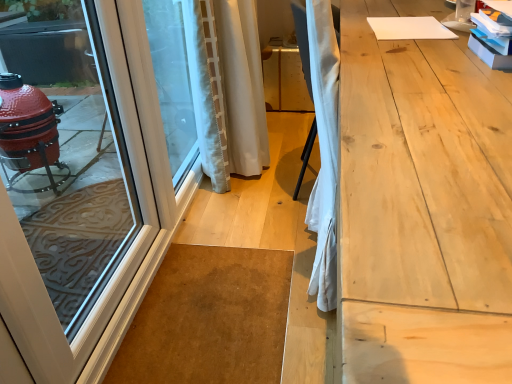
Looking at this image, what is the approximate height of transparent glass window screen at left?

transparent glass window screen at left is 88.68 centimeters in height.

I want to click on white textured curtain at center, so click(x=226, y=90).

Locate an element on the screen. This screenshot has width=512, height=384. light wood workbench at right is located at coordinates (423, 207).

Is the position of white textured curtain at center more distant than that of transparent glass window screen at left?

Yes, white textured curtain at center is behind transparent glass window screen at left.

Is white textured curtain at center directly adjacent to transparent glass window screen at left?

No, white textured curtain at center is not with transparent glass window screen at left.

Which is behind, point (248, 115) or point (178, 130)?

The point (178, 130) is farther from the camera.

Which of these two, white textured curtain at center or transparent glass window screen at left, stands taller?

Standing taller between the two is transparent glass window screen at left.

Is light wood workbench at right oriented towards white glossy door at left?

No, light wood workbench at right does not turn towards white glossy door at left.

Visually, is light wood workbench at right positioned to the left or to the right of white glossy door at left?

From the image, it's evident that light wood workbench at right is to the right of white glossy door at left.

Is light wood workbench at right next to white glossy door at left and touching it?

light wood workbench at right is not next to white glossy door at left, and they're not touching.

From the image's perspective, is light wood workbench at right below white glossy door at left?

No, from the image's perspective, light wood workbench at right is not below white glossy door at left.

Is white glossy door at left oriented towards transparent glass window screen at left?

No, white glossy door at left is not facing towards transparent glass window screen at left.

Looking at this image, between white glossy door at left and transparent glass window screen at left, which one has more height?

white glossy door at left.

What's the angular difference between white glossy door at left and transparent glass window screen at left's facing directions?

There is a 0.0015-degree angle between the facing directions of white glossy door at left and transparent glass window screen at left.

Considering the positions of objects white glossy door at left and white textured curtain at center in the image provided, who is in front, white glossy door at left or white textured curtain at center?

Positioned in front is white glossy door at left.

Considering the relative sizes of white glossy door at left and white textured curtain at center in the image provided, is white glossy door at left bigger than white textured curtain at center?

Incorrect, white glossy door at left is not larger than white textured curtain at center.

From the image's perspective, is white glossy door at left located above white textured curtain at center?

Incorrect, from the image's perspective, white glossy door at left is lower than white textured curtain at center.

Can you tell me how much white glossy door at left and white textured curtain at center differ in facing direction?

0.0892 degrees separate the facing orientations of white glossy door at left and white textured curtain at center.

Which of these two, transparent glass window screen at left or white glossy door at left, is bigger?

With larger size is white glossy door at left.

Is transparent glass window screen at left further to camera compared to white glossy door at left?

Yes, transparent glass window screen at left is behind white glossy door at left.

From the image's perspective, who appears lower, transparent glass window screen at left or white glossy door at left?

white glossy door at left is shown below in the image.

Based on the photo, can you confirm if transparent glass window screen at left is positioned to the right of white glossy door at left?

Yes.

From a real-world perspective, which is physically below, white glossy door at left or light wood workbench at right?

light wood workbench at right is physically lower.

Between white glossy door at left and light wood workbench at right, which one has less height?

With less height is light wood workbench at right.

Considering the relative sizes of white glossy door at left and light wood workbench at right in the image provided, is white glossy door at left bigger than light wood workbench at right?

No.

Is white glossy door at left positioned behind light wood workbench at right?

That is True.

Between transparent glass window screen at left and white textured curtain at center, which one is positioned behind?

white textured curtain at center is more distant.

Who is bigger, transparent glass window screen at left or white textured curtain at center?

white textured curtain at center.

Is transparent glass window screen at left inside the boundaries of white textured curtain at center, or outside?

transparent glass window screen at left is not enclosed by white textured curtain at center.

Where is `window screen lying on the left of white textured curtain at center`? window screen lying on the left of white textured curtain at center is located at coordinates (172, 84).

This screenshot has width=512, height=384. Identify the location of door below the light wood workbench at right (from the image's perspective). (67, 182).

Estimate the real-world distances between objects in this image. Which object is further from white glossy door at left, white textured curtain at center or transparent glass window screen at left?

white textured curtain at center is further to white glossy door at left.

Looking at this image, estimate the real-world distances between objects in this image. Which object is further from light wood workbench at right, white textured curtain at center or transparent glass window screen at left?

The object further to light wood workbench at right is transparent glass window screen at left.

Based on their spatial positions, is white glossy door at left or transparent glass window screen at left further from light wood workbench at right?

Based on the image, white glossy door at left appears to be further to light wood workbench at right.

Estimate the real-world distances between objects in this image. Which object is further from white textured curtain at center, transparent glass window screen at left or white glossy door at left?

Based on the image, white glossy door at left appears to be further to white textured curtain at center.

From the image, which object appears to be farther from white textured curtain at center, light wood workbench at right or white glossy door at left?

light wood workbench at right is further to white textured curtain at center.

Which object lies further to the anchor point white glossy door at left, light wood workbench at right or white textured curtain at center?

The object further to white glossy door at left is light wood workbench at right.

Looking at the image, which one is located closer to white glossy door at left, transparent glass window screen at left or light wood workbench at right?

Based on the image, transparent glass window screen at left appears to be nearer to white glossy door at left.

Estimate the real-world distances between objects in this image. Which object is further from white glossy door at left, light wood workbench at right or transparent glass window screen at left?

light wood workbench at right lies further to white glossy door at left than the other object.

Identify the location of window screen positioned between white glossy door at left and white textured curtain at center from near to far. (172, 84).

The image size is (512, 384). Identify the location of window screen located between light wood workbench at right and white textured curtain at center in the depth direction. (172, 84).

At what (x,y) coordinates should I click in order to perform the action: click on window screen between white glossy door at left and light wood workbench at right. Please return your answer as a coordinate pair (x, y). The width and height of the screenshot is (512, 384). Looking at the image, I should click on (172, 84).

What are the coordinates of `door between light wood workbench at right and white textured curtain at center in the front-back direction` in the screenshot? It's located at (67, 182).